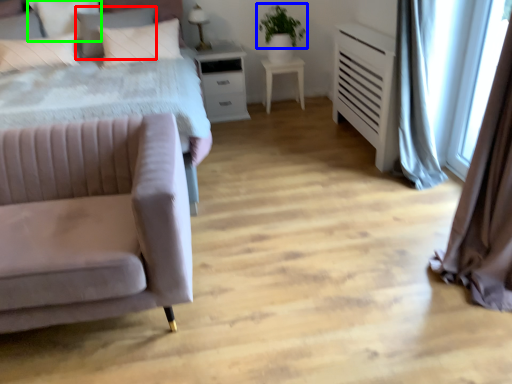
Question: Based on their relative distances, which object is nearer to pillow (highlighted by a red box)? Choose from plant (highlighted by a blue box) and pillow (highlighted by a green box).

Choices:
 (A) plant
 (B) pillow

Answer: (B)